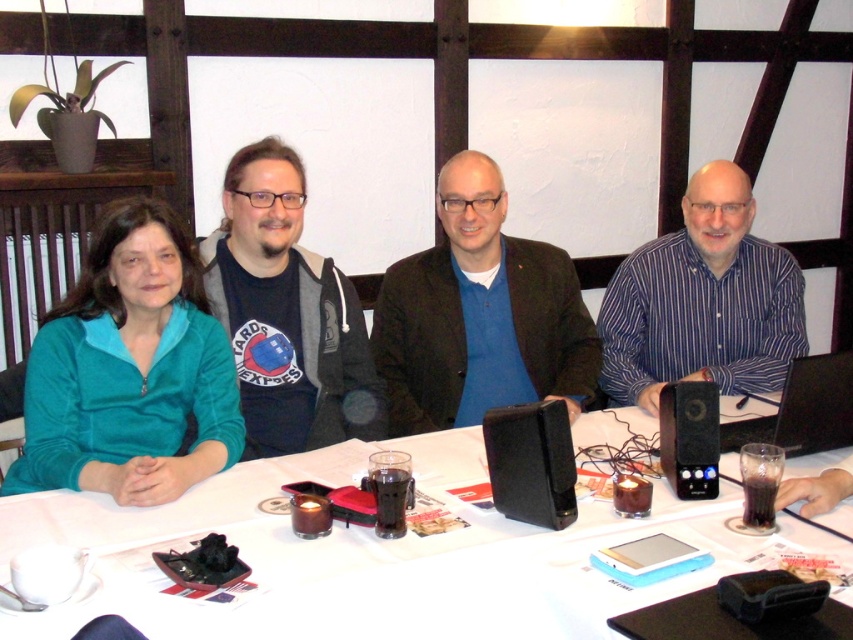
You are organizing a clothing donation drive and need to determine which of the two items, the blue matte jacket at center or the matte black hoodie at center, can fit into a standard donation box that accommodates items up to the size of the larger garment. Which item should you choose?

The blue matte jacket at center is larger in size than the matte black hoodie at center, so you should choose the blue matte jacket at center to fit into the donation box designed for the larger garment.

You are trying to locate the black leather speaker at center in the image. According to the coordinates provided, where would you find it?

The black leather speaker at center is located at point 0.723 on the x axis and 0.624 on the y axis.

You are sitting at the table and want to move the black plastic speaker at lower right closer to you. Which direction should you move it relative to the black leather speaker at center?

You should move the black plastic speaker at lower right towards the black leather speaker at center since the black leather speaker at center is in front of it, meaning the plastic speaker is behind the leather one and needs to be moved forward to be closer to you.